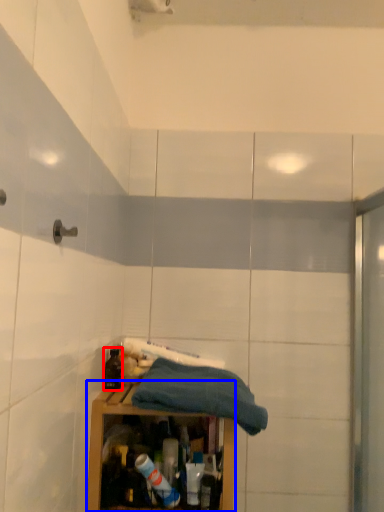
Question: Which object appears closest to the camera in this image, bottle (highlighted by a red box) or cabinetry (highlighted by a blue box)?

Choices:
 (A) bottle
 (B) cabinetry

Answer: (B)